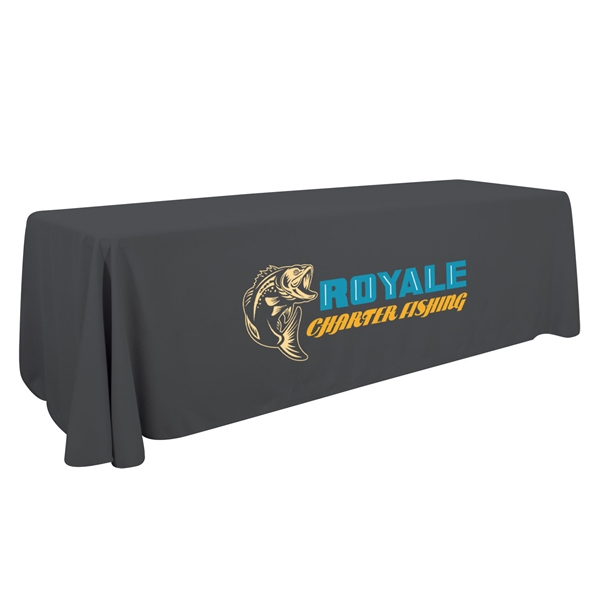
Where is `center of table top`? The height and width of the screenshot is (600, 600). center of table top is located at coordinates (315, 204).